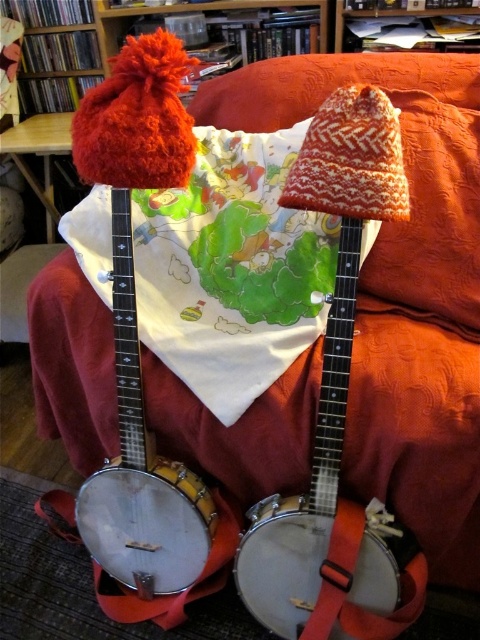
The image size is (480, 640). Describe the element at coordinates (334, 406) in the screenshot. I see `matte white banjo at center` at that location.

Is matte white banjo at center above white wooden banjo at center?

Yes.

The height and width of the screenshot is (640, 480). I want to click on matte white banjo at center, so click(334, 406).